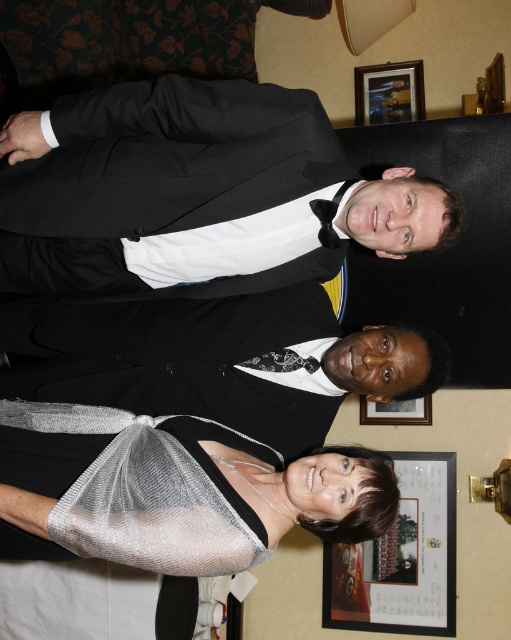
Is black satin tuxedo at upper center positioned at the back of framed paper at lower right?

No, it is not.

Is black satin tuxedo at upper center thinner than framed paper at lower right?

No, black satin tuxedo at upper center is not thinner than framed paper at lower right.

Where is `black satin tuxedo at upper center`? Image resolution: width=511 pixels, height=640 pixels. black satin tuxedo at upper center is located at coordinates (197, 193).

Does point (268, 522) lie behind point (381, 76)?

No, it is in front of (381, 76).

Between silver mesh shawl at lower center and wooden picture frame at upper center, which one has less height?

With less height is wooden picture frame at upper center.

Does point (161, 464) lie behind point (411, 99)?

That is False.

Find the location of a particular element. The width and height of the screenshot is (511, 640). silver mesh shawl at lower center is located at coordinates (196, 493).

Which is behind, point (423, 504) or point (276, 353)?

Point (423, 504)

Is the position of framed paper at lower right less distant than that of black satin tie at center?

No, framed paper at lower right is behind black satin tie at center.

Is point (363, 589) positioned in front of point (297, 356)?

No, (363, 589) is behind (297, 356).

Find the location of a particular element. The height and width of the screenshot is (640, 511). framed paper at lower right is located at coordinates (401, 557).